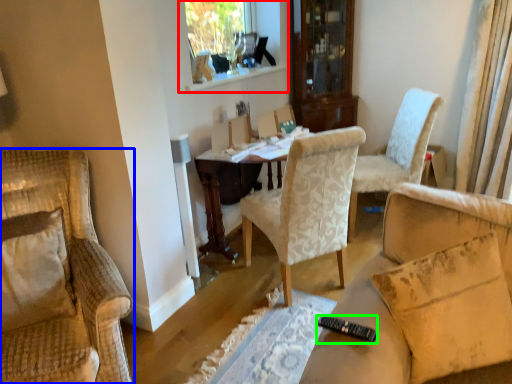
Question: Based on their relative distances, which object is nearer to window frame (highlighted by a red box)? Choose from chair (highlighted by a blue box) and remote control (highlighted by a green box).

Choices:
 (A) chair
 (B) remote control

Answer: (A)